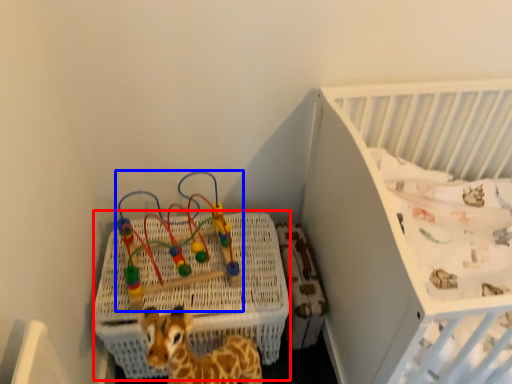
Question: Which of the following is the closest to the observer, crate (highlighted by a red box) or toy (highlighted by a blue box)?

Choices:
 (A) crate
 (B) toy

Answer: (B)